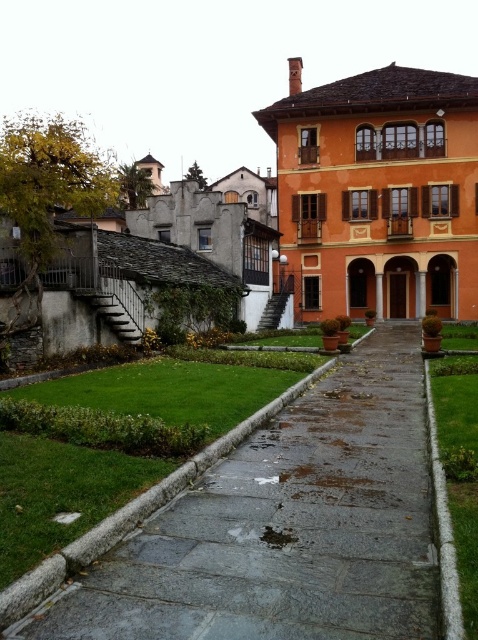
Based on the photo, is gray concrete path at center further to the viewer compared to green grass at center?

Yes, gray concrete path at center is further from the viewer.

At what (x,y) coordinates should I click in order to perform the action: click on gray concrete path at center. Please return your answer as a coordinate pair (x, y). This screenshot has height=640, width=478. Looking at the image, I should click on (284, 528).

Does point (304, 417) come behind point (444, 397)?

No, it is not.

At what (x,y) coordinates should I click in order to perform the action: click on gray concrete path at center. Please return your answer as a coordinate pair (x, y). Looking at the image, I should click on (284, 528).